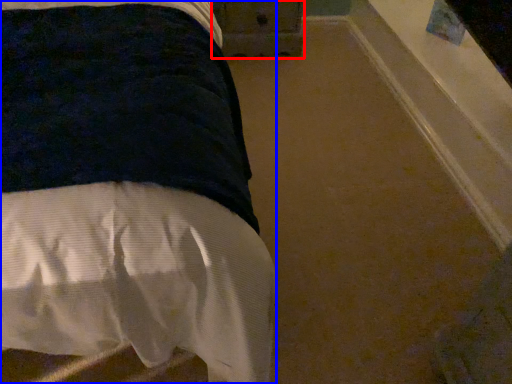
Question: Which object is further to the camera taking this photo, drawer (highlighted by a red box) or bed (highlighted by a blue box)?

Choices:
 (A) drawer
 (B) bed

Answer: (A)